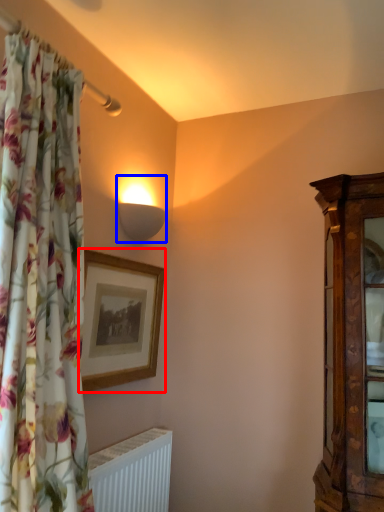
Question: Which point is closer to the camera, picture frame (highlighted by a red box) or lamp (highlighted by a blue box)?

Choices:
 (A) picture frame
 (B) lamp

Answer: (A)